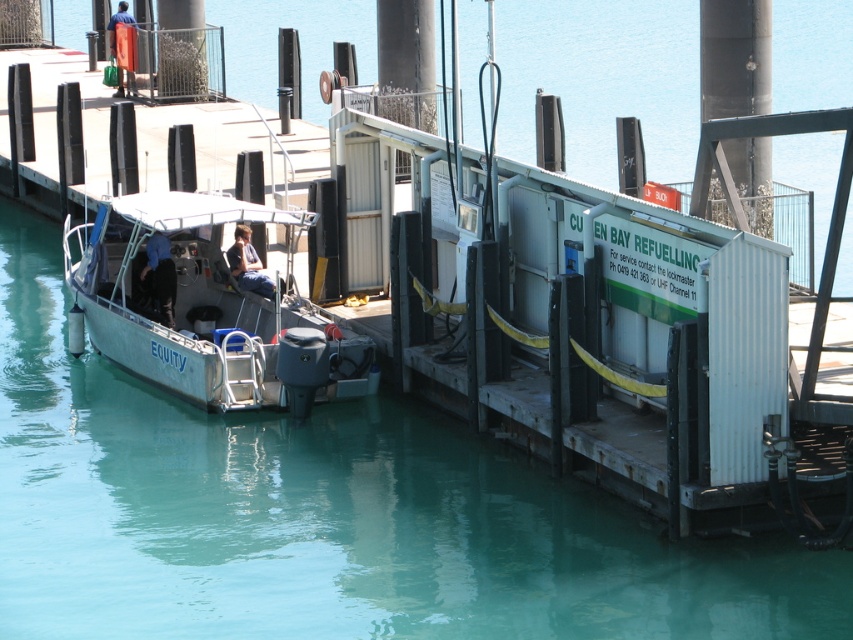
You are a marine engineer planning to install a new sensor on the metallic gray boat at center. The sensor must be placed at the exact center of the boat. Given the boat is at coordinates 0.808, 0.385, what coordinates should the sensor be placed at?

The sensor should be placed at the same coordinates as the boat, which is (328, 516), since the boat itself is already centered at that point.

You are standing on the dock and want to board the boat named EQUITY. The boat has two points marked as point 1 at coordinates point (x=21, y=429) and point 2 at coordinates point (x=138, y=275). Which point should you aim for if you want to step onto the part of the boat closest to the front?

Point 1 at coordinates point (x=21, y=429) is in front of point 2 at coordinates point (x=138, y=275), so you should aim for point 1 at coordinates point (x=21, y=429) to step onto the front part of the boat.